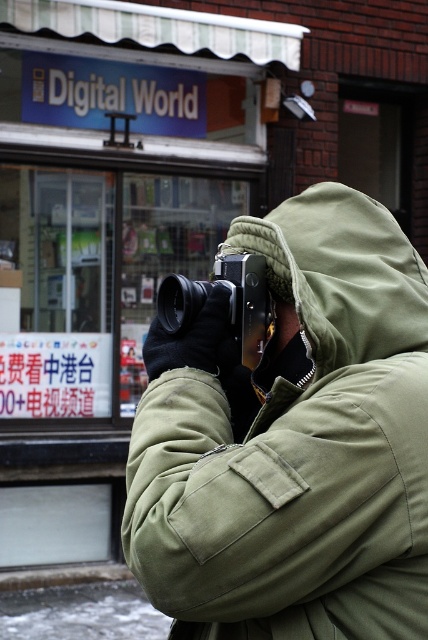
Does green matte/twill trench coat at center have a larger size compared to green fabric hood at center?

Correct, green matte/twill trench coat at center is larger in size than green fabric hood at center.

Looking at this image, who is higher up, green matte/twill trench coat at center or green fabric hood at center?

Positioned higher is green fabric hood at center.

Describe the element at coordinates (291, 442) in the screenshot. I see `green matte/twill trench coat at center` at that location.

I want to click on green matte/twill trench coat at center, so click(291, 442).

Does green fabric hood at center lie behind metallic silver camera at center?

No, it is not.

Can you confirm if green fabric hood at center is taller than metallic silver camera at center?

Correct, green fabric hood at center is much taller as metallic silver camera at center.

At what (x,y) coordinates should I click in order to perform the action: click on green fabric hood at center. Please return your answer as a coordinate pair (x, y). This screenshot has width=428, height=640. Looking at the image, I should click on (341, 273).

At what (x,y) coordinates should I click in order to perform the action: click on green fabric hood at center. Please return your answer as a coordinate pair (x, y). The width and height of the screenshot is (428, 640). Looking at the image, I should click on (341, 273).

Is point (333, 449) closer to camera compared to point (238, 289)?

Yes.

Looking at this image, is green matte/twill trench coat at center positioned behind metallic silver camera at center?

That is False.

You are a GUI agent. You are given a task and a screenshot of the screen. Output one action in this format:
    pyautogui.click(x=<x>, y=<y>)
    Task: Click on the green matte/twill trench coat at center
    Image resolution: width=428 pixels, height=640 pixels.
    Given the screenshot: What is the action you would take?
    pyautogui.click(x=291, y=442)